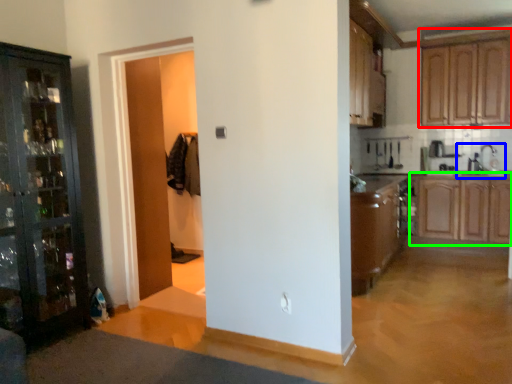
Question: Which is nearer to the cabinetry (highlighted by a red box)? sink (highlighted by a blue box) or cabinetry (highlighted by a green box).

Choices:
 (A) sink
 (B) cabinetry

Answer: (A)